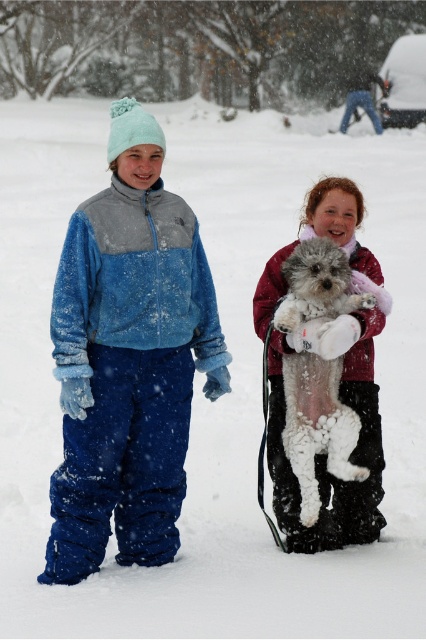
Question: Does fuzzy blue snowsuit at left have a larger size compared to white fluffy dog at center?

Choices:
 (A) yes
 (B) no

Answer: (A)

Question: Which object is closer to the camera taking this photo?

Choices:
 (A) white fluffy dog at center
 (B) fuzzy blue snowsuit at left

Answer: (B)

Question: Which point is closer to the camera?

Choices:
 (A) (304, 268)
 (B) (63, 257)

Answer: (B)

Question: Is the position of fuzzy blue snowsuit at left more distant than that of white fluffy dog at center?

Choices:
 (A) yes
 (B) no

Answer: (B)

Question: Is fuzzy blue snowsuit at left bigger than white fluffy dog at center?

Choices:
 (A) no
 (B) yes

Answer: (B)

Question: Which object appears farthest from the camera in this image?

Choices:
 (A) white fluffy dog at center
 (B) fuzzy blue snowsuit at left

Answer: (A)